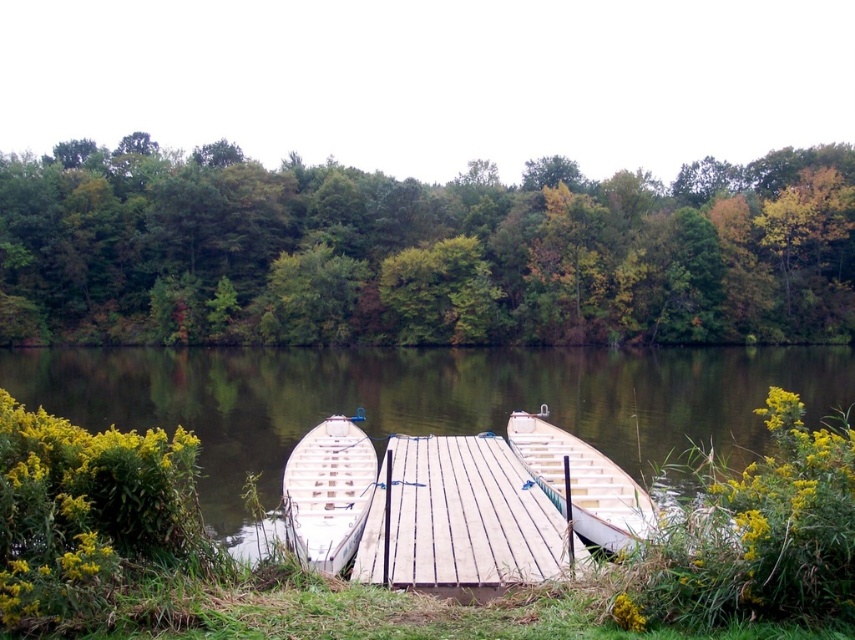
Question: Which object appears closest to the camera in this image?

Choices:
 (A) clear water at center
 (B) white wood boat at left
 (C) green leafy trees at upper center

Answer: (B)

Question: Is clear water at center closer to camera compared to white wood boat at left?

Choices:
 (A) yes
 (B) no

Answer: (B)

Question: Is wooden planks at center bigger than white wood boat at left?

Choices:
 (A) yes
 (B) no

Answer: (B)

Question: Which of the following is the farthest from the observer?

Choices:
 (A) (396, 417)
 (B) (517, 244)
 (C) (292, 532)
 (D) (605, 481)

Answer: (B)

Question: Which point is closer to the camera?

Choices:
 (A) light brown wooden canoe at center
 (B) wooden planks at center
 (C) clear water at center

Answer: (A)

Question: Does wooden planks at center have a larger size compared to white wood boat at left?

Choices:
 (A) yes
 (B) no

Answer: (B)